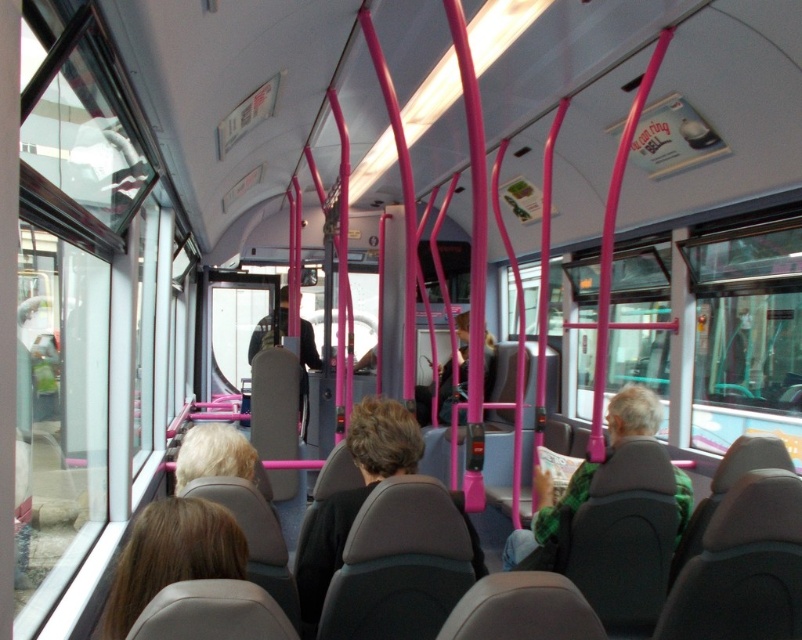
Question: Does black fabric jacket at center have a smaller size compared to dark gray fabric jacket at center?

Choices:
 (A) yes
 (B) no

Answer: (A)

Question: Is blonde hair at lower left to the right of dark gray fabric jacket at center from the viewer's perspective?

Choices:
 (A) yes
 (B) no

Answer: (A)

Question: Is black fabric jacket at center thinner than green plaid shirt at center?

Choices:
 (A) yes
 (B) no

Answer: (A)

Question: Among these points, which one is nearest to the camera?

Choices:
 (A) (586, 493)
 (B) (248, 352)
 (C) (320, 513)

Answer: (C)

Question: Among these objects, which one is farthest from the camera?

Choices:
 (A) black fabric jacket at center
 (B) blonde hair at lower left
 (C) green plaid shirt at center
 (D) dark gray fabric jacket at center

Answer: (D)

Question: Which of the following is the farthest from the observer?

Choices:
 (A) green plaid shirt at center
 (B) black fabric jacket at center
 (C) dark green sweater at center
 (D) blonde hair at lower left

Answer: (C)